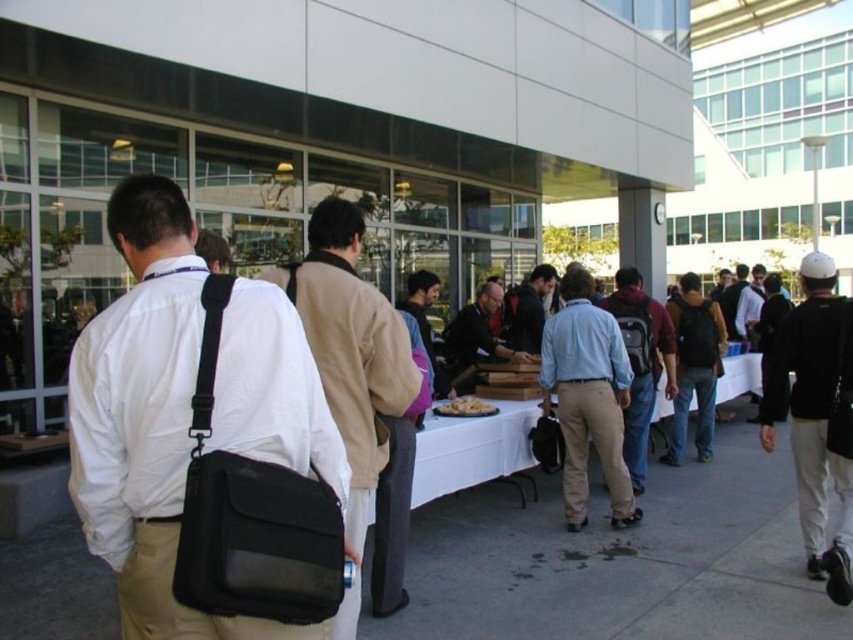
You are attending an event and need to place your black fabric bag at center on the table. Can you put it on the right side of the white cloth table at center?

The black fabric bag at center is positioned on the left side of white cloth table at center, so you can place it on the right side of the white cloth table at center since it is currently on the left side.

You are organizing a photo shoot and need to place a 1.2 meter tall tripod between the black cotton jacket at right and the dark blue backpack at center. Based on their heights, will the tripod be taller than both objects?

The black cotton jacket at right has a lesser height compared to dark blue backpack at center. Since the tripod is 1.2 meters tall, and the backpack is taller than the jacket, the tripod will be taller than both objects if the backpack is shorter than 1.2 meters. However, without knowing the exact height of the backpack, we can only confirm it will be taller than the jacket. But according to the description, the jacket is shorter than the backpack. If the backpack is under 1.2m, then yes. Since the scene is